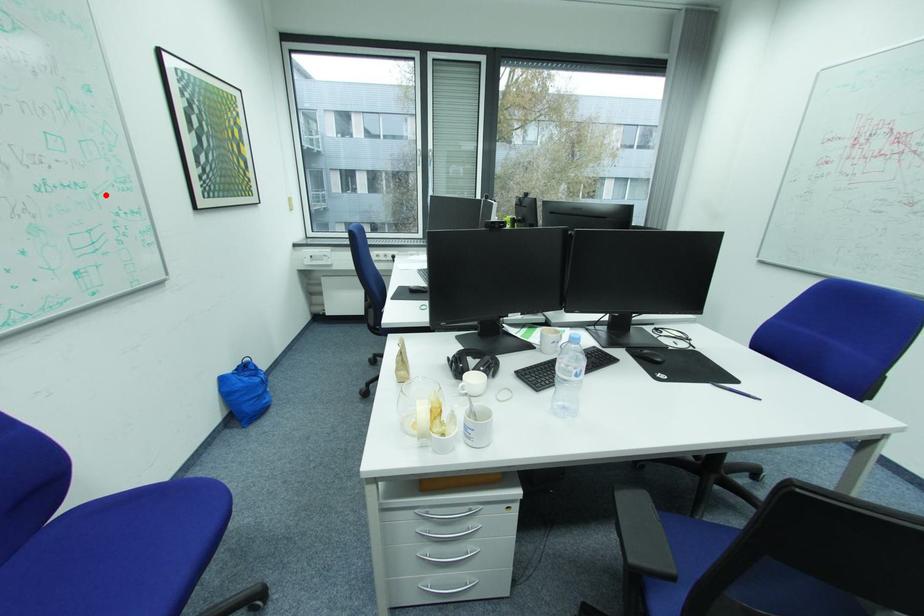
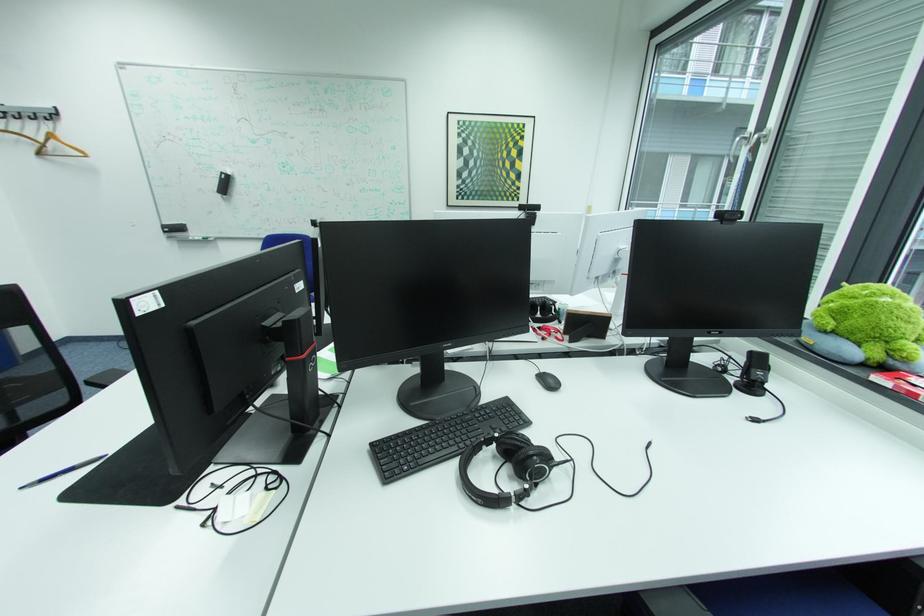
Question: I am providing you with two images of the same scene from different viewpoints. A red point is shown in image1. For the corresponding object point in image2, is it positioned nearer or farther from the camera?

Choices:
 (A) Nearer
 (B) Farther

Answer: (A)